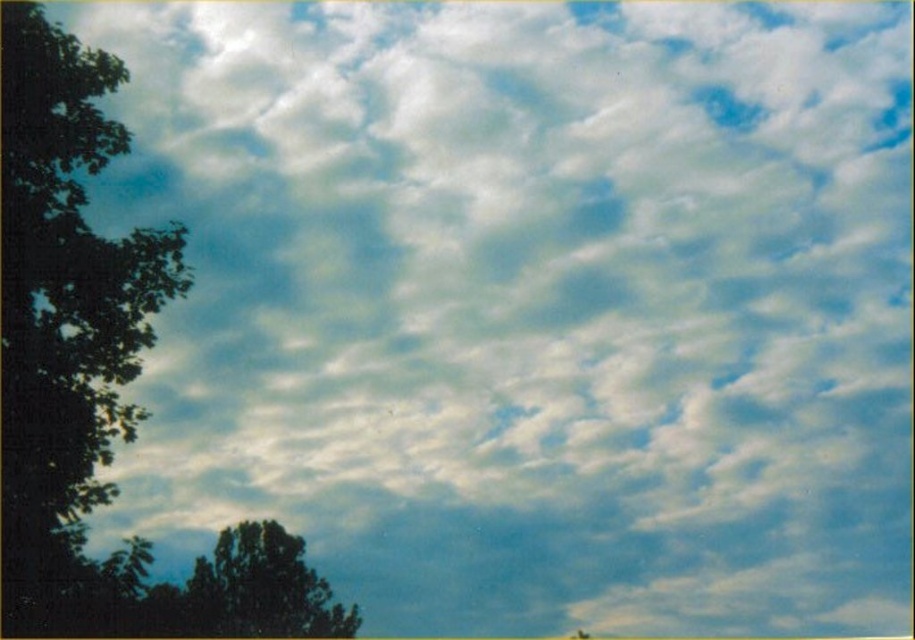
Question: Can you confirm if green leafy tree at left is positioned above green leafy tree at lower left?

Choices:
 (A) no
 (B) yes

Answer: (B)

Question: Considering the relative positions of green leafy tree at left and green leafy tree at lower left in the image provided, where is green leafy tree at left located with respect to green leafy tree at lower left?

Choices:
 (A) left
 (B) right

Answer: (A)

Question: Which of the following is the closest to the observer?

Choices:
 (A) green leafy tree at lower left
 (B) green leafy tree at left

Answer: (B)

Question: Is green leafy tree at left positioned at the back of green leafy tree at lower left?

Choices:
 (A) yes
 (B) no

Answer: (B)